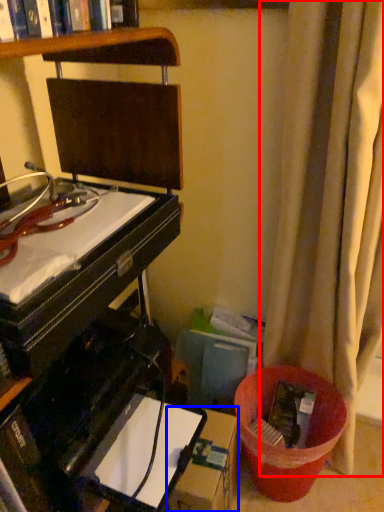
Question: Which point is further to the camera, curtain (highlighted by a red box) or cardboard box (highlighted by a blue box)?

Choices:
 (A) curtain
 (B) cardboard box

Answer: (B)